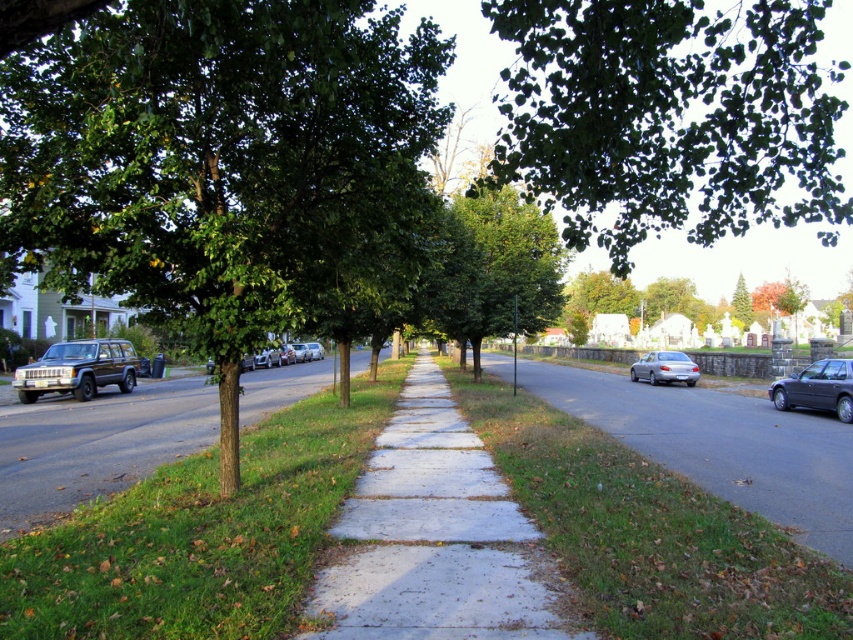
Question: Does green leafy tree at upper center have a larger size compared to smooth asphalt road at left?

Choices:
 (A) no
 (B) yes

Answer: (B)

Question: Is shiny black sedan at right wider than satin silver sedan at right?

Choices:
 (A) no
 (B) yes

Answer: (A)

Question: Which point appears closest to the camera in this image?

Choices:
 (A) (625, 72)
 (B) (828, 477)
 (C) (315, 609)
 (D) (21, 429)

Answer: (C)

Question: Which of the following is the farthest from the observer?

Choices:
 (A) green leafy tree at center
 (B) green leafy tree at left
 (C) silver metallic sedan at center

Answer: (C)

Question: Which of the following is the closest to the observer?

Choices:
 (A) smooth asphalt road at left
 (B) green leafy tree at left
 (C) satin silver sedan at right

Answer: (B)

Question: Can you confirm if concrete at center is smaller than smooth asphalt road at left?

Choices:
 (A) no
 (B) yes

Answer: (B)